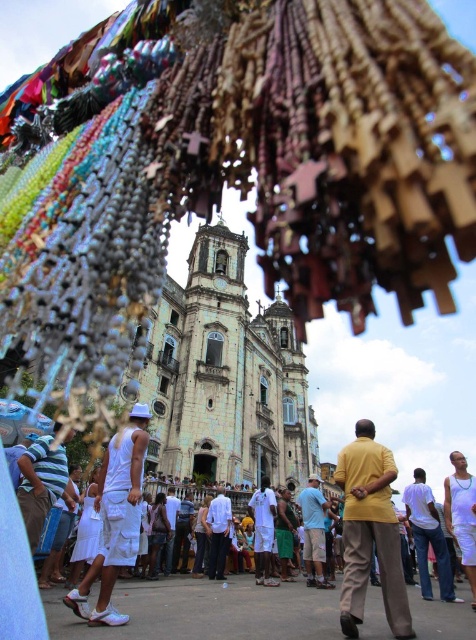
You are standing in the outdoor scene and see a person wearing a yellow matte shirt at center and white cotton shorts at lower left. Which piece of clothing is positioned more to the left?

The white cotton shorts at lower left are positioned more to the left compared to the yellow matte shirt at center.